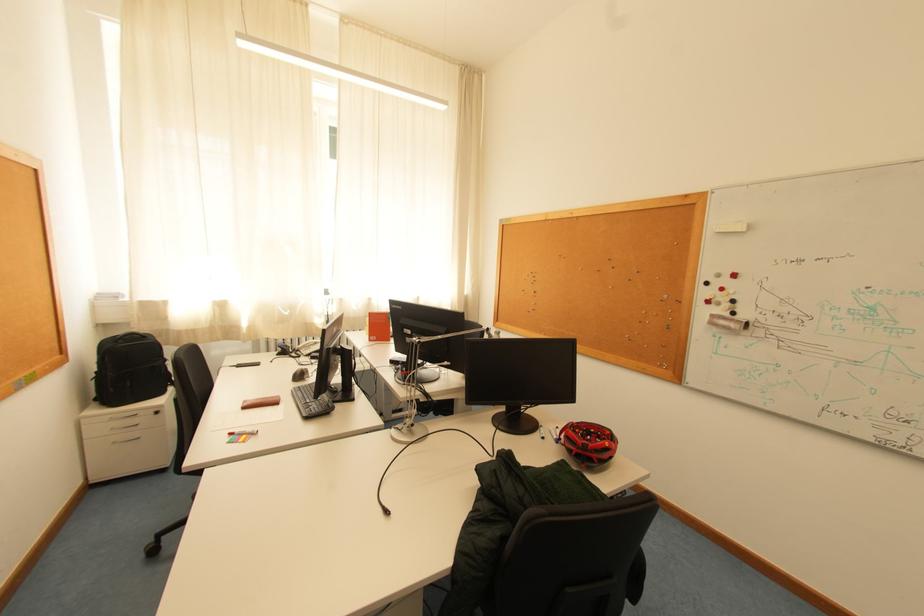
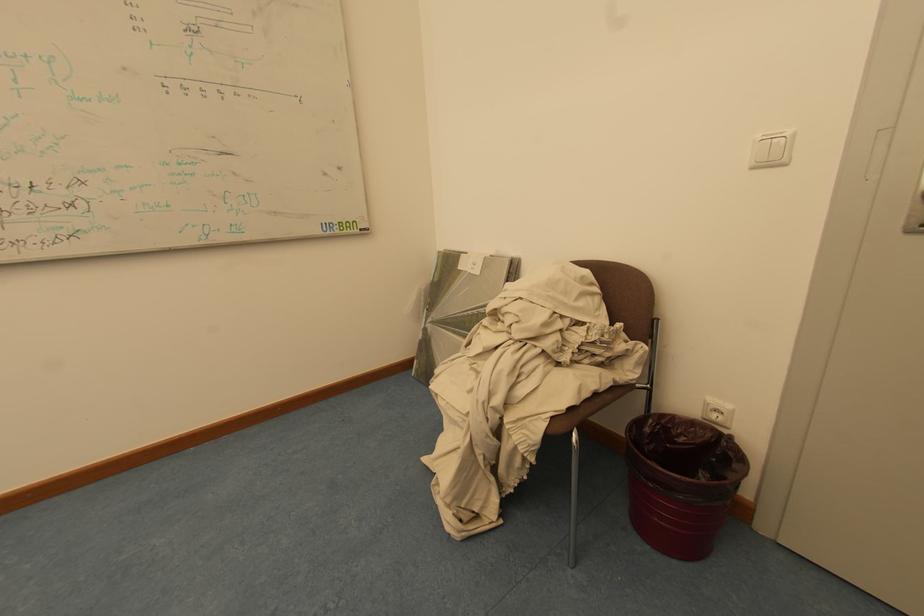
How did the camera likely rotate?

The camera's rotation is toward right-down.